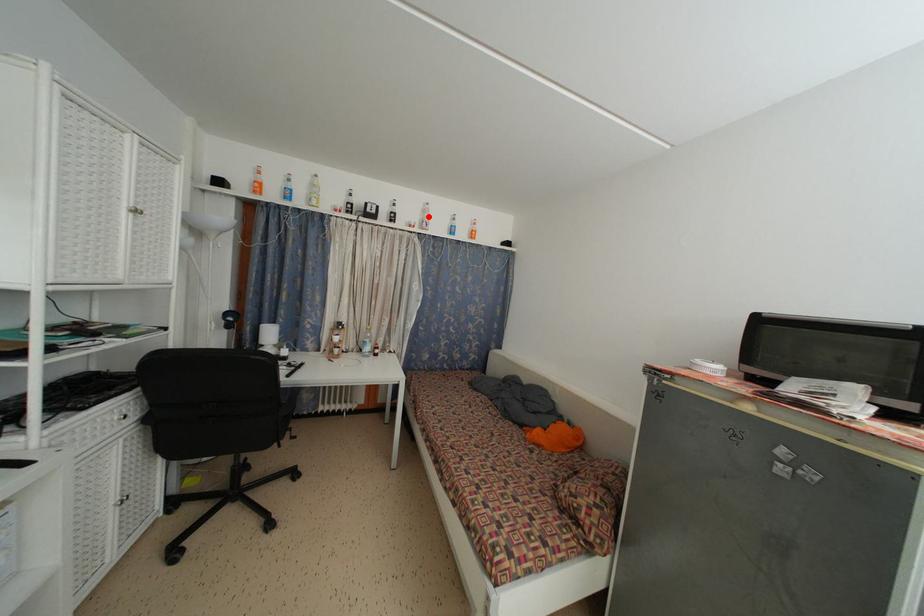
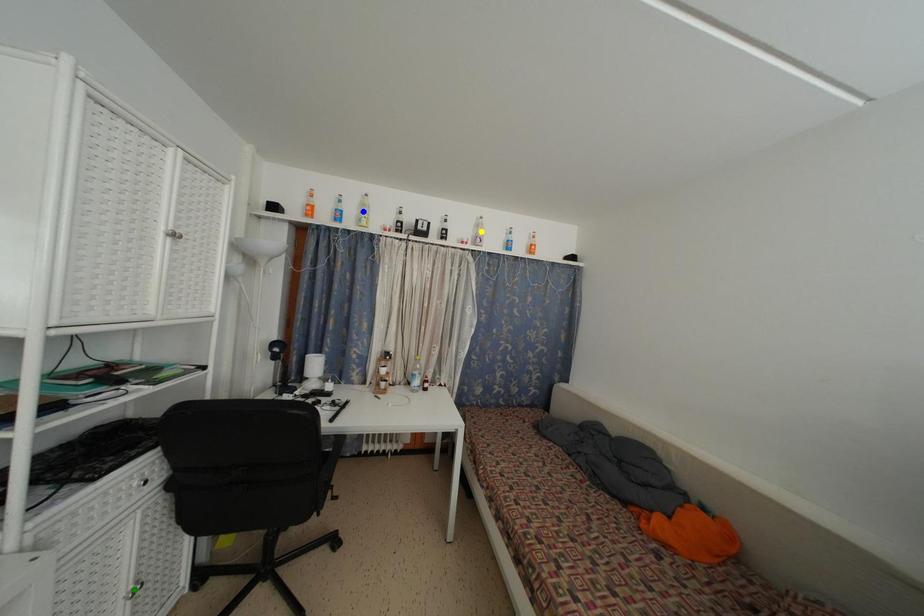
Question: I am providing you with two images of the same scene from different viewpoints. A red point is marked on the first image. You are given multiple points on the second image. Which spot in image 2 lines up with the point in image 1?

Choices:
 (A) green point
 (B) blue point
 (C) yellow point

Answer: (C)